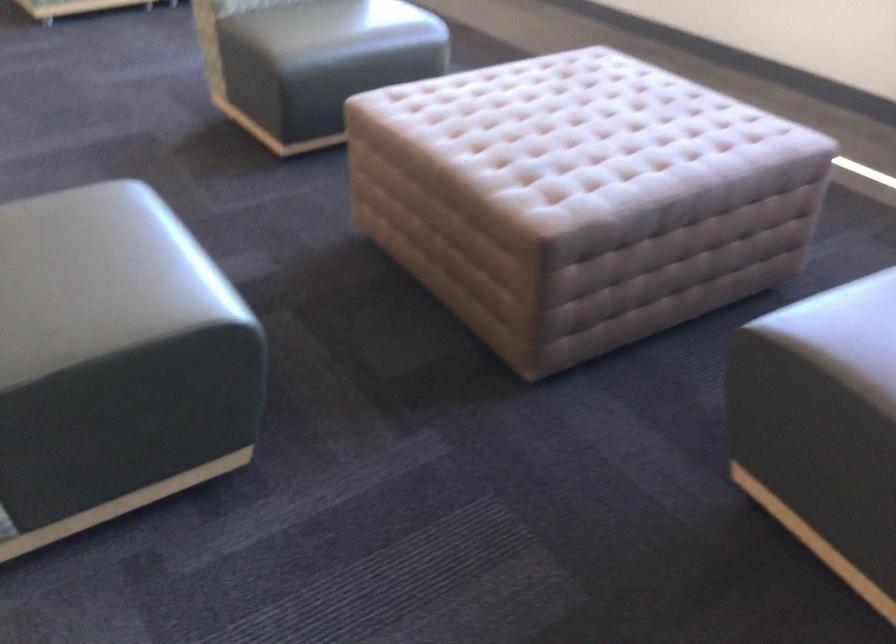
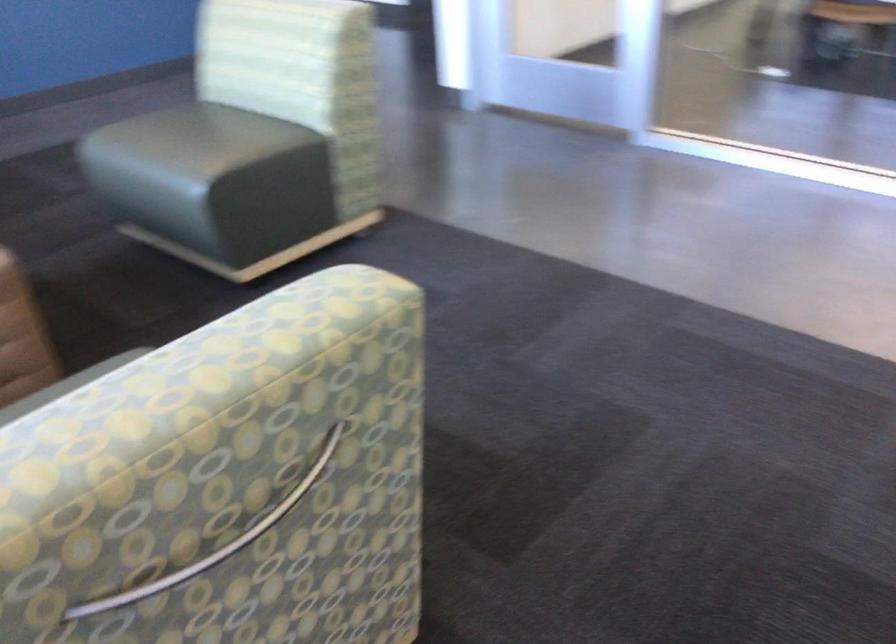
Where in the second image is the point corresponding to point (140, 221) from the first image?

(192, 143)